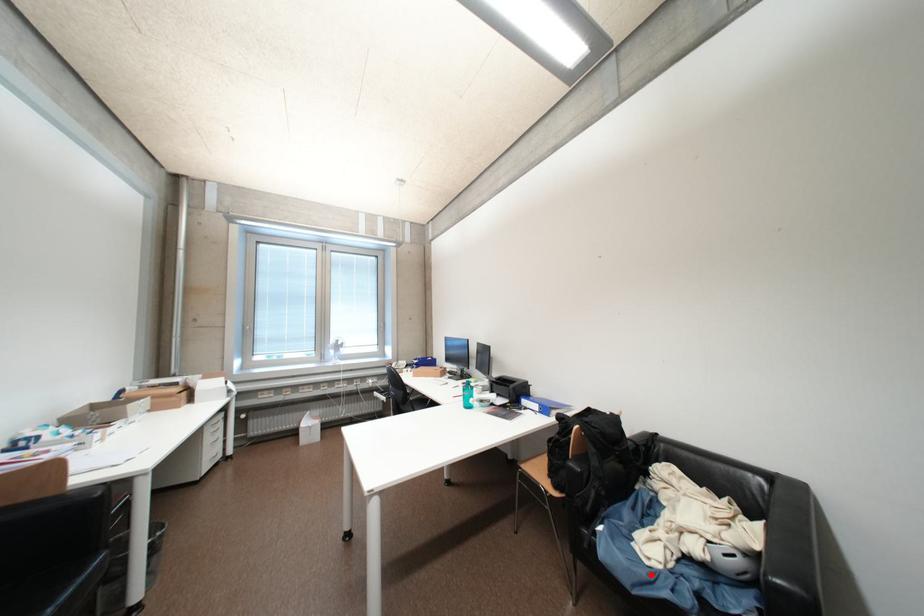
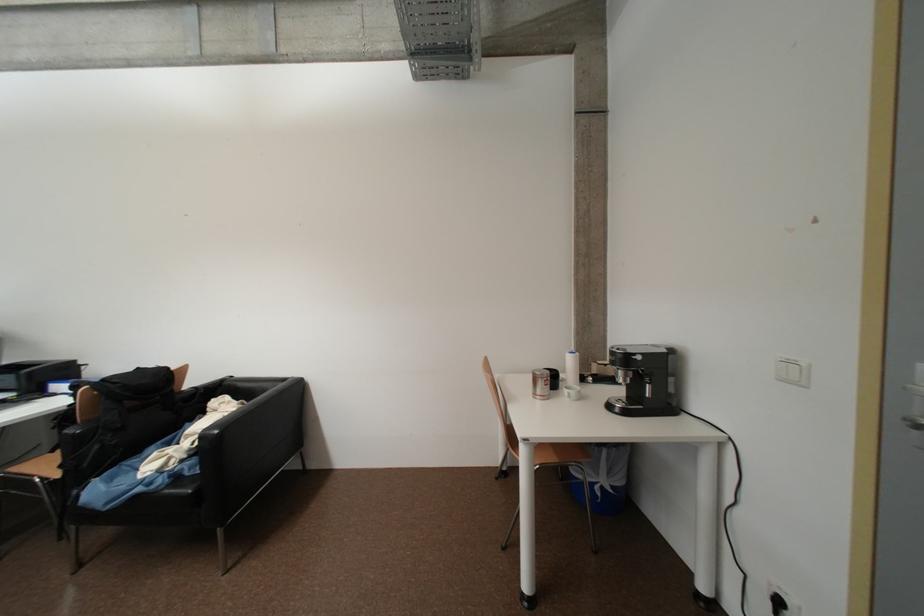
Question: I am providing you with two images of the same scene from different viewpoints. Image1 has a red point marked. In image2, the corresponding 3D location appears at what relative position? Reply with the corresponding letter.

Choices:
 (A) Closer
 (B) Farther

Answer: (A)